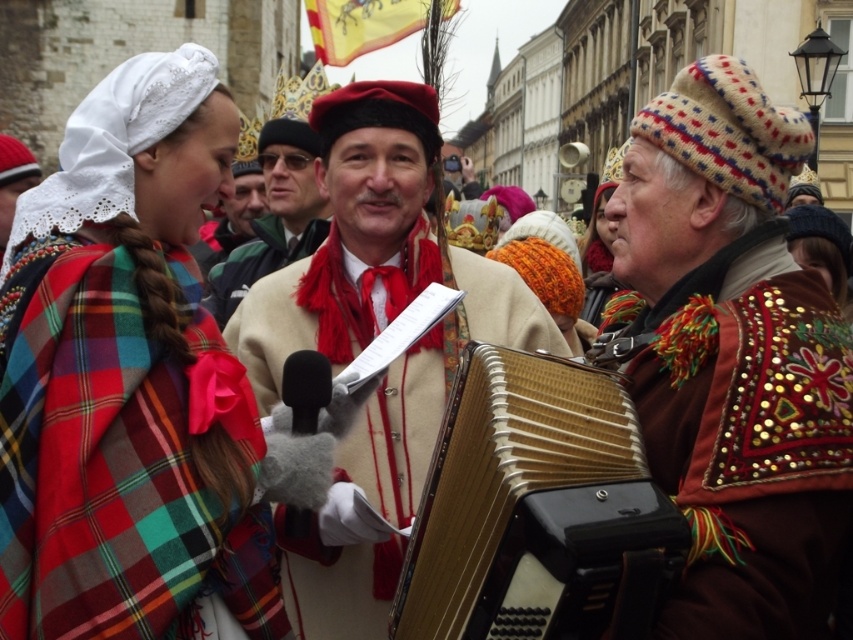
You are standing at the origin point in the image. Which of the two points, point (724, 294) or point (283, 260), is closer to you?

Point (724, 294) is closer to you because it is in front of point (283, 260).